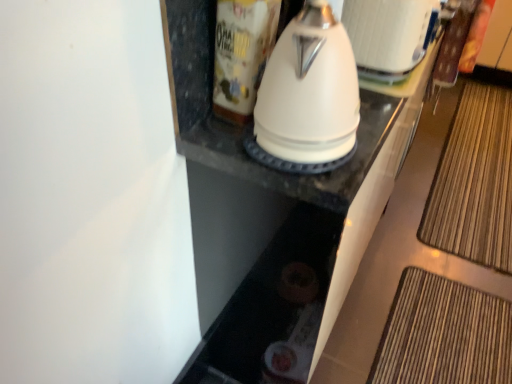
Question: From a real-world perspective, is white glossy kettle at upper center positioned over white glossy kettle at center based on gravity?

Choices:
 (A) yes
 (B) no

Answer: (B)

Question: Is white glossy kettle at upper center at the right side of white glossy kettle at center?

Choices:
 (A) no
 (B) yes

Answer: (B)

Question: Could you tell me if white glossy kettle at upper center is turned towards white glossy kettle at center?

Choices:
 (A) no
 (B) yes

Answer: (A)

Question: Considering the relative positions of white glossy kettle at upper center and white glossy kettle at center in the image provided, is white glossy kettle at upper center behind white glossy kettle at center?

Choices:
 (A) yes
 (B) no

Answer: (A)

Question: Considering the relative sizes of white glossy kettle at upper center and white glossy kettle at center in the image provided, is white glossy kettle at upper center shorter than white glossy kettle at center?

Choices:
 (A) no
 (B) yes

Answer: (B)

Question: In the image, is white glossy kettle at center on the left side or the right side of bamboo mat at lower right?

Choices:
 (A) left
 (B) right

Answer: (A)

Question: From a real-world perspective, relative to bamboo mat at lower right, is white glossy kettle at center vertically above or below?

Choices:
 (A) below
 (B) above

Answer: (B)

Question: From their relative heights in the image, would you say white glossy kettle at center is taller or shorter than bamboo mat at lower right?

Choices:
 (A) short
 (B) tall

Answer: (B)

Question: From the image's perspective, is white glossy kettle at center above or below bamboo mat at lower right?

Choices:
 (A) below
 (B) above

Answer: (A)

Question: Is bamboo mat at lower right wider or thinner than white glossy kettle at center?

Choices:
 (A) wide
 (B) thin

Answer: (A)

Question: In terms of size, does bamboo mat at lower right appear bigger or smaller than white glossy kettle at center?

Choices:
 (A) big
 (B) small

Answer: (A)

Question: Relative to white glossy kettle at center, is bamboo mat at lower right in front or behind?

Choices:
 (A) front
 (B) behind

Answer: (B)

Question: Is point [490, 216] positioned closer to the camera than point [335, 140]?

Choices:
 (A) closer
 (B) farther

Answer: (B)

Question: Considering the positions of white glossy kettle at upper center and white glossy canister at upper center in the image, is white glossy kettle at upper center bigger or smaller than white glossy canister at upper center?

Choices:
 (A) small
 (B) big

Answer: (B)

Question: From the image's perspective, relative to white glossy canister at upper center, is white glossy kettle at upper center above or below?

Choices:
 (A) below
 (B) above

Answer: (B)